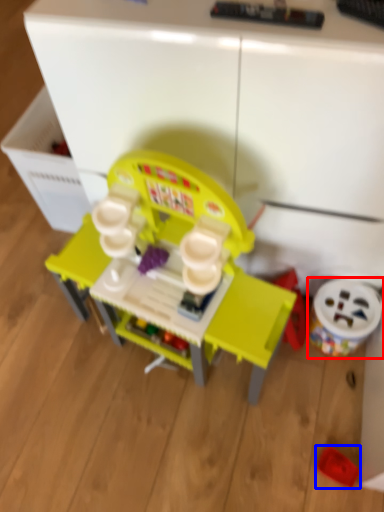
Question: Which of the following is the farthest to the observer, toy (highlighted by a red box) or toy (highlighted by a blue box)?

Choices:
 (A) toy
 (B) toy

Answer: (A)